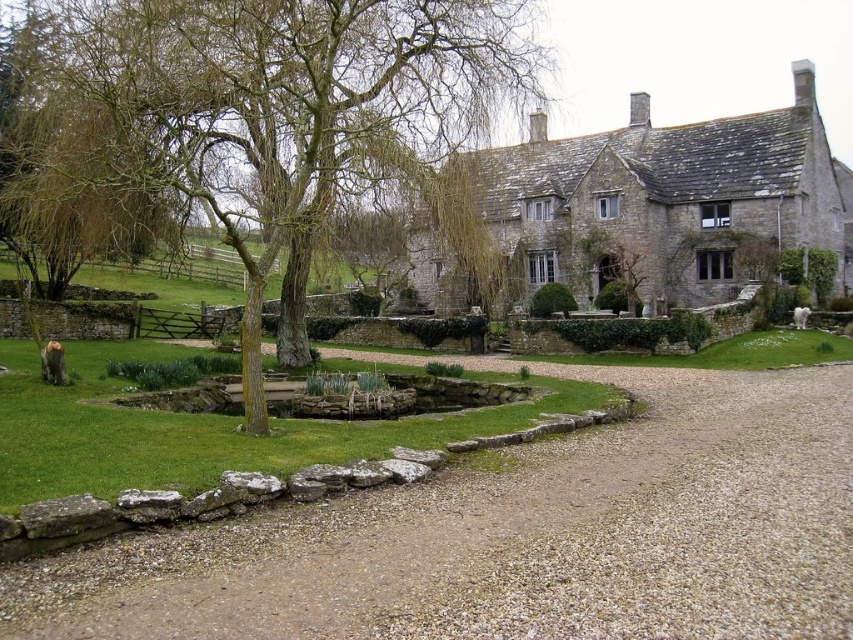
Question: Can you confirm if green leafy tree at upper left is thinner than white fluffy dog at lower right?

Choices:
 (A) no
 (B) yes

Answer: (A)

Question: Does gray gravel at center have a smaller size compared to green leafy tree at upper left?

Choices:
 (A) yes
 (B) no

Answer: (A)

Question: Based on their relative distances, which object is nearer to the white fluffy dog at lower right?

Choices:
 (A) green leafy tree at upper left
 (B) gray gravel at center

Answer: (B)

Question: Which object appears farthest from the camera in this image?

Choices:
 (A) gray gravel at center
 (B) green leafy tree at upper left
 (C) white fluffy dog at lower right

Answer: (C)

Question: Which point is farther from the camera taking this photo?

Choices:
 (A) (805, 317)
 (B) (126, 70)

Answer: (A)

Question: Is gray gravel at center thinner than white fluffy dog at lower right?

Choices:
 (A) yes
 (B) no

Answer: (B)